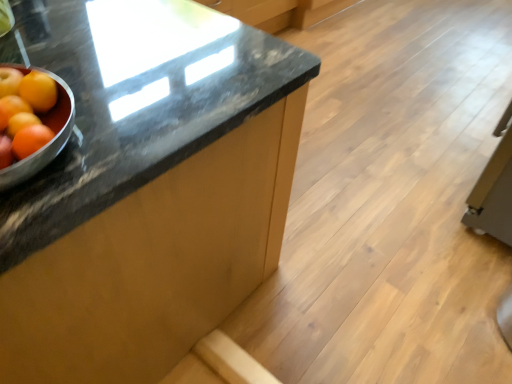
Identify the location of empty space that is to the right of orange matte at left. (121, 126).